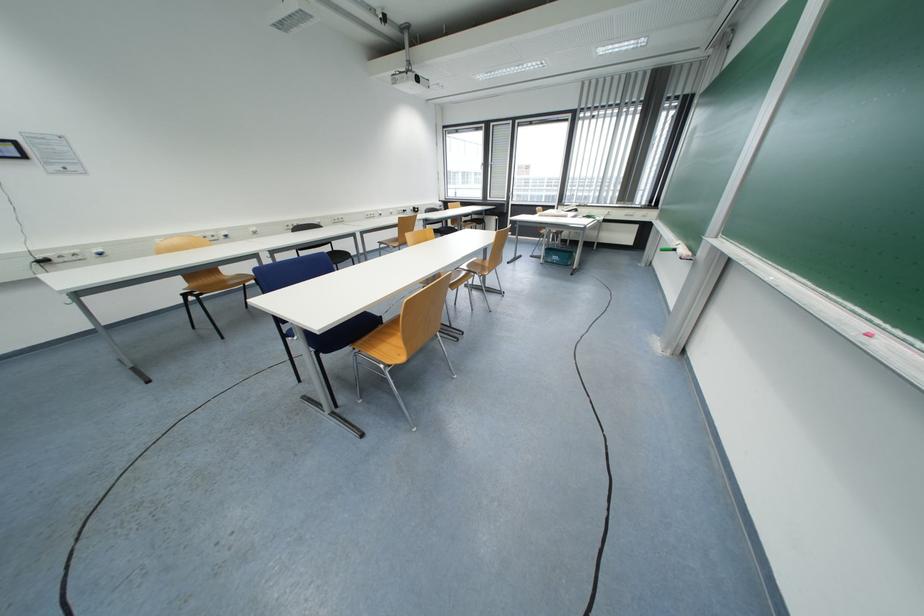
Locate an element on the screen. black chair surface is located at coordinates (341, 333).